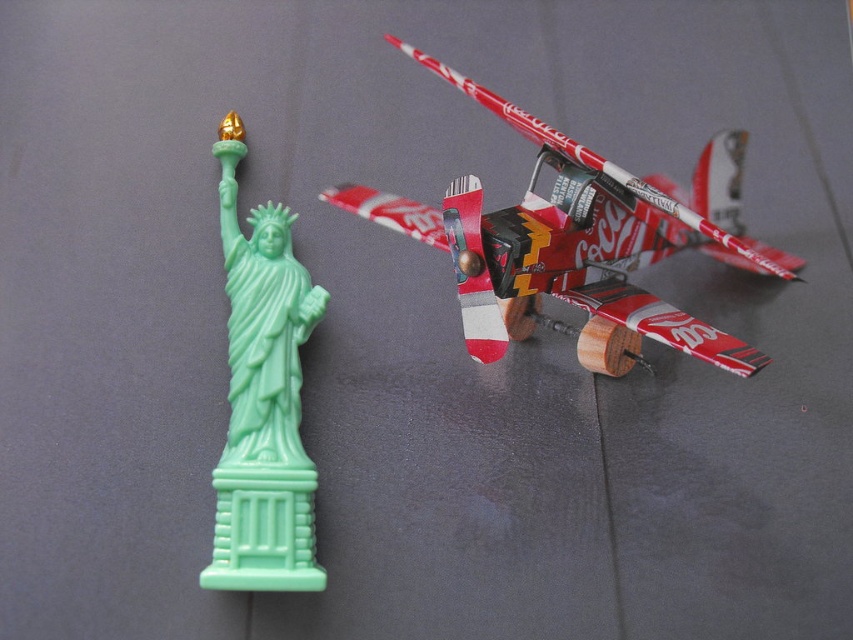
What is the object located at the coordinates point (x=579, y=243) in the image?

The object at point (x=579, y=243) is the red and white paper airplane at right.

You are standing in front of a desk with a mint green Statue of Liberty figurine and a Coca Cola model airplane. You want to place a small sticker exactly halfway between the two points marked as point (590,323) and point (242,580). Will the sticker be closer to the Statue of Liberty or the model airplane?

The sticker placed halfway between point (590,323) and point (242,580) will be closer to the model airplane because point (590,323) is closer to the viewer than point (242,580), making the midpoint lean towards the latter.